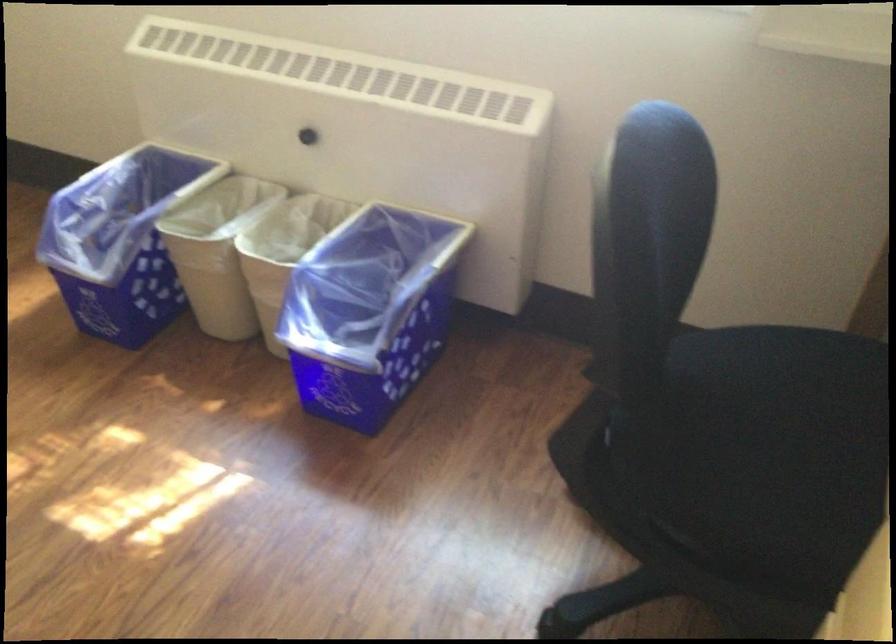
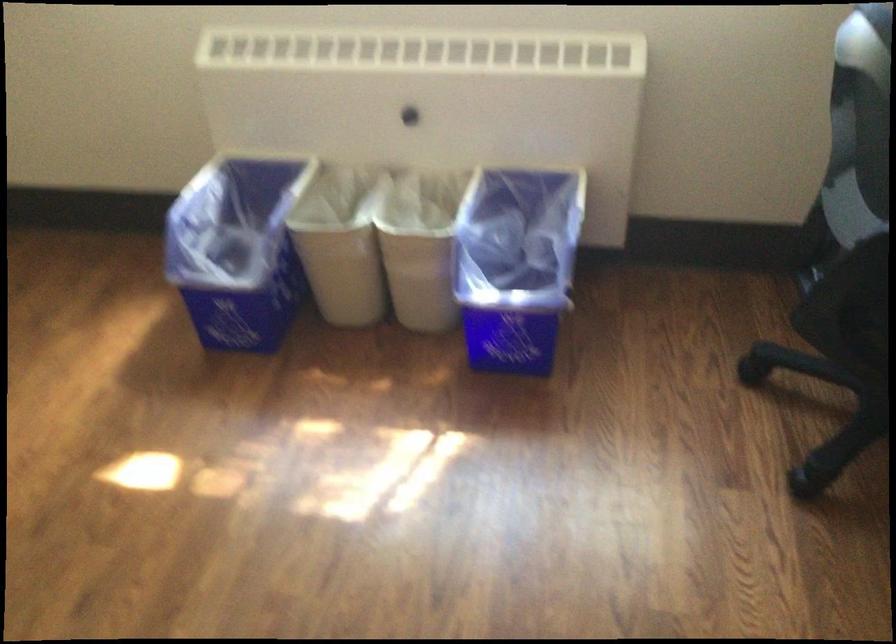
Find the pixel in the second image that matches (x=126, y=240) in the first image.

(237, 249)